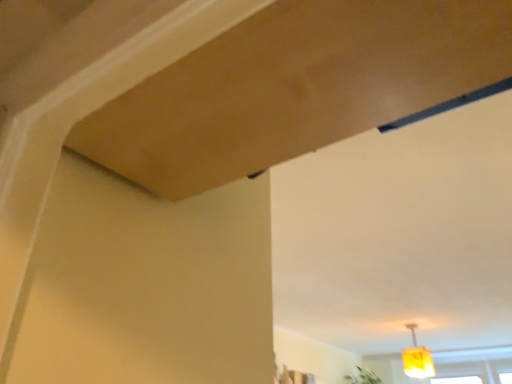
Question: Should I look upward or downward to see yellow fabric lampshade at lower right?

Choices:
 (A) down
 (B) up

Answer: (A)